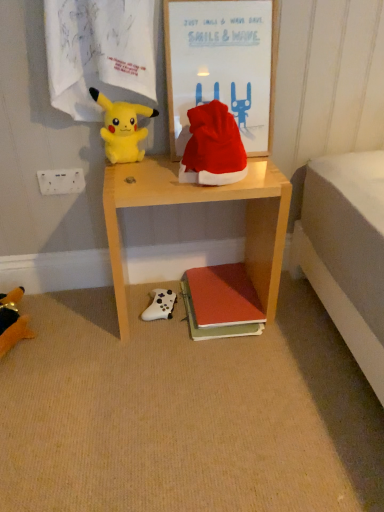
The height and width of the screenshot is (512, 384). I want to click on free space in front of soft plush toy at lower left, the 3th toy when ordered from top to bottom, so click(33, 398).